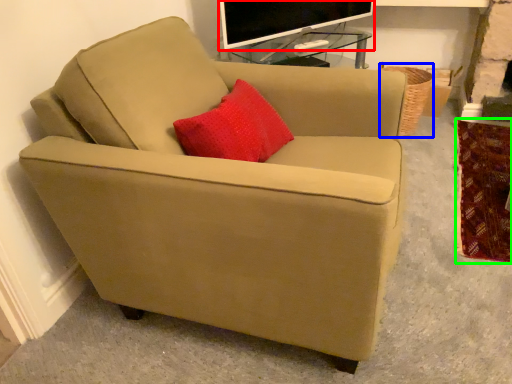
Question: Which object is positioned closest to television (highlighted by a red box)? Select from basket (highlighted by a blue box) and blanket (highlighted by a green box).

Choices:
 (A) basket
 (B) blanket

Answer: (A)